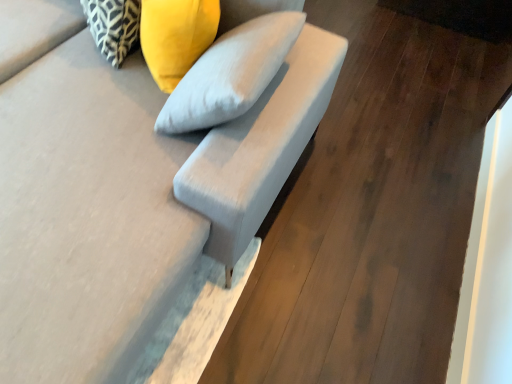
What do you see at coordinates (260, 147) in the screenshot? Image resolution: width=512 pixels, height=384 pixels. I see `suede-like gray armchair at center` at bounding box center [260, 147].

In order to face yellow fabric pillow at upper center, the first pillow from the right, should I rotate leftwards or rightwards?

A 10.087 degree turn to the left will do.

Measure the distance between point (197, 216) and camera.

The depth of point (197, 216) is 3.70 feet.

This screenshot has height=384, width=512. Identify the location of suede-like gray armchair at center. click(260, 147).

Is patterned fabric pillow at upper left, acting as the 2th pillow starting from the right, aimed at suede-like gray armchair at center?

No.

Does point (137, 29) come closer to viewer compared to point (242, 119)?

No, it is behind (242, 119).

The width and height of the screenshot is (512, 384). Find the location of `armchair on the right of patterned fabric pillow at upper left, acting as the first pillow starting from the left`. armchair on the right of patterned fabric pillow at upper left, acting as the first pillow starting from the left is located at coordinates pyautogui.click(x=260, y=147).

Is patterned fabric pillow at upper left, acting as the first pillow starting from the left, in front of or behind suede-like gray armchair at center in the image?

patterned fabric pillow at upper left, acting as the first pillow starting from the left, is positioned farther from the viewer than suede-like gray armchair at center.

Who is bigger, yellow fabric pillow at upper center, the first pillow from the right, or suede-like gray armchair at center?

suede-like gray armchair at center is bigger.

Does point (153, 26) appear closer or farther from the camera than point (217, 258)?

Point (153, 26) appears to be closer to the viewer than point (217, 258).

From a real-world perspective, is yellow fabric pillow at upper center, which ranks as the second pillow in left-to-right order, above or below suede-like gray armchair at center?

Clearly, from a real-world perspective, yellow fabric pillow at upper center, which ranks as the second pillow in left-to-right order, is above suede-like gray armchair at center.

Is yellow fabric pillow at upper center, the first pillow from the right, situated inside suede-like gray armchair at center or outside?

yellow fabric pillow at upper center, the first pillow from the right, is inside suede-like gray armchair at center.

Is suede gray sofa at center touching suede-like gray armchair at center?

No, suede gray sofa at center is not touching suede-like gray armchair at center.

The height and width of the screenshot is (384, 512). I want to click on armchair on the right side of suede gray sofa at center, so click(x=260, y=147).

Is the position of suede gray sofa at center less distant than that of suede-like gray armchair at center?

Yes, the depth of suede gray sofa at center is less than that of suede-like gray armchair at center.

Can you confirm if suede gray sofa at center is smaller than suede-like gray armchair at center?

Actually, suede gray sofa at center might be larger than suede-like gray armchair at center.

Which of these two, suede gray sofa at center or yellow fabric pillow at upper center, the first pillow from the right, stands shorter?

yellow fabric pillow at upper center, the first pillow from the right.

Does suede gray sofa at center turn towards yellow fabric pillow at upper center, which ranks as the second pillow in left-to-right order?

No, suede gray sofa at center is not turned towards yellow fabric pillow at upper center, which ranks as the second pillow in left-to-right order.

How different are the orientations of suede gray sofa at center and yellow fabric pillow at upper center, the first pillow from the right, in degrees?

The angular difference between suede gray sofa at center and yellow fabric pillow at upper center, the first pillow from the right, is 44.6 degrees.

This screenshot has width=512, height=384. I want to click on the 1st pillow above the suede gray sofa at center (from the image's perspective), so click(176, 36).

Is patterned fabric pillow at upper left, acting as the first pillow starting from the left, bigger than yellow fabric pillow at upper center, the first pillow from the right?

No, patterned fabric pillow at upper left, acting as the first pillow starting from the left, is not bigger than yellow fabric pillow at upper center, the first pillow from the right.

Is patterned fabric pillow at upper left, acting as the 2th pillow starting from the right, inside or outside of yellow fabric pillow at upper center, the first pillow from the right?

The correct answer is: outside.

From the image's perspective, is patterned fabric pillow at upper left, acting as the 2th pillow starting from the right, located beneath yellow fabric pillow at upper center, which ranks as the second pillow in left-to-right order?

Actually, patterned fabric pillow at upper left, acting as the 2th pillow starting from the right, appears above yellow fabric pillow at upper center, which ranks as the second pillow in left-to-right order, in the image.

Is patterned fabric pillow at upper left, acting as the 2th pillow starting from the right, at the left side of yellow fabric pillow at upper center, the first pillow from the right?

Yes, patterned fabric pillow at upper left, acting as the 2th pillow starting from the right, is to the left of yellow fabric pillow at upper center, the first pillow from the right.

Considering the points (314, 116) and (168, 81), which point is behind, point (314, 116) or point (168, 81)?

Positioned behind is point (314, 116).

Can you confirm if suede-like gray armchair at center is positioned to the left of yellow fabric pillow at upper center, which ranks as the second pillow in left-to-right order?

No.

How many degrees apart are the facing directions of suede-like gray armchair at center and yellow fabric pillow at upper center, the first pillow from the right?

47.6 degrees separate the facing orientations of suede-like gray armchair at center and yellow fabric pillow at upper center, the first pillow from the right.

Is point (321, 53) in front of point (96, 1)?

No, (321, 53) is behind (96, 1).

Is suede-like gray armchair at center turned away from patterned fabric pillow at upper left, acting as the first pillow starting from the left?

No, patterned fabric pillow at upper left, acting as the first pillow starting from the left, is not at the back of suede-like gray armchair at center.

From the image's perspective, is suede-like gray armchair at center on patterned fabric pillow at upper left, acting as the first pillow starting from the left?

Actually, suede-like gray armchair at center appears below patterned fabric pillow at upper left, acting as the first pillow starting from the left, in the image.

You are a GUI agent. You are given a task and a screenshot of the screen. Output one action in this format:
    pyautogui.click(x=<x>, y=<y>)
    Task: Click on the armchair below the patterned fabric pillow at upper left, acting as the first pillow starting from the left (from the image's perspective)
    The height and width of the screenshot is (384, 512).
    Given the screenshot: What is the action you would take?
    pyautogui.click(x=260, y=147)

Locate an element on the screen. The width and height of the screenshot is (512, 384). armchair located below the patterned fabric pillow at upper left, acting as the first pillow starting from the left (from the image's perspective) is located at coordinates (260, 147).

This screenshot has width=512, height=384. Find the location of `armchair that appears in front of the yellow fabric pillow at upper center, the first pillow from the right`. armchair that appears in front of the yellow fabric pillow at upper center, the first pillow from the right is located at coordinates (260, 147).

Estimate the real-world distances between objects in this image. Which object is closer to yellow fabric pillow at upper center, which ranks as the second pillow in left-to-right order, suede gray sofa at center or suede-like gray armchair at center?

The object closer to yellow fabric pillow at upper center, which ranks as the second pillow in left-to-right order, is suede gray sofa at center.

Based on their spatial positions, is suede-like gray armchair at center or patterned fabric pillow at upper left, acting as the first pillow starting from the left, closer to yellow fabric pillow at upper center, the first pillow from the right?

Based on the image, patterned fabric pillow at upper left, acting as the first pillow starting from the left, appears to be nearer to yellow fabric pillow at upper center, the first pillow from the right.

From the image, which object appears to be nearer to yellow fabric pillow at upper center, the first pillow from the right, suede-like gray armchair at center or suede gray sofa at center?

suede gray sofa at center is positioned closer to the anchor yellow fabric pillow at upper center, the first pillow from the right.

Based on their spatial positions, is suede gray sofa at center or patterned fabric pillow at upper left, acting as the 2th pillow starting from the right, further from suede-like gray armchair at center?

patterned fabric pillow at upper left, acting as the 2th pillow starting from the right, is positioned further to the anchor suede-like gray armchair at center.

When comparing their distances from suede-like gray armchair at center, does patterned fabric pillow at upper left, acting as the 2th pillow starting from the right, or yellow fabric pillow at upper center, the first pillow from the right, seem closer?

The object closer to suede-like gray armchair at center is yellow fabric pillow at upper center, the first pillow from the right.

From the image, which object appears to be nearer to suede gray sofa at center, yellow fabric pillow at upper center, which ranks as the second pillow in left-to-right order, or patterned fabric pillow at upper left, acting as the 2th pillow starting from the right?

Among the two, yellow fabric pillow at upper center, which ranks as the second pillow in left-to-right order, is located nearer to suede gray sofa at center.

Considering their positions, is suede-like gray armchair at center positioned closer to suede gray sofa at center than patterned fabric pillow at upper left, acting as the 2th pillow starting from the right?

The object closer to suede gray sofa at center is suede-like gray armchair at center.

From the image, which object appears to be farther from patterned fabric pillow at upper left, acting as the first pillow starting from the left, suede-like gray armchair at center or yellow fabric pillow at upper center, which ranks as the second pillow in left-to-right order?

suede-like gray armchair at center lies further to patterned fabric pillow at upper left, acting as the first pillow starting from the left, than the other object.

Find the location of `armchair located between suede gray sofa at center and patterned fabric pillow at upper left, acting as the 2th pillow starting from the right, in the depth direction`. armchair located between suede gray sofa at center and patterned fabric pillow at upper left, acting as the 2th pillow starting from the right, in the depth direction is located at coordinates [x=260, y=147].

Locate an element on the screen. Image resolution: width=512 pixels, height=384 pixels. pillow positioned between suede gray sofa at center and patterned fabric pillow at upper left, acting as the first pillow starting from the left, from near to far is located at coordinates (176, 36).

The height and width of the screenshot is (384, 512). I want to click on pillow situated between patterned fabric pillow at upper left, acting as the 2th pillow starting from the right, and suede-like gray armchair at center from left to right, so click(x=176, y=36).

At what (x,y) coordinates should I click in order to perform the action: click on armchair located between suede gray sofa at center and yellow fabric pillow at upper center, which ranks as the second pillow in left-to-right order, in the depth direction. Please return your answer as a coordinate pair (x, y). This screenshot has height=384, width=512. Looking at the image, I should click on (260, 147).